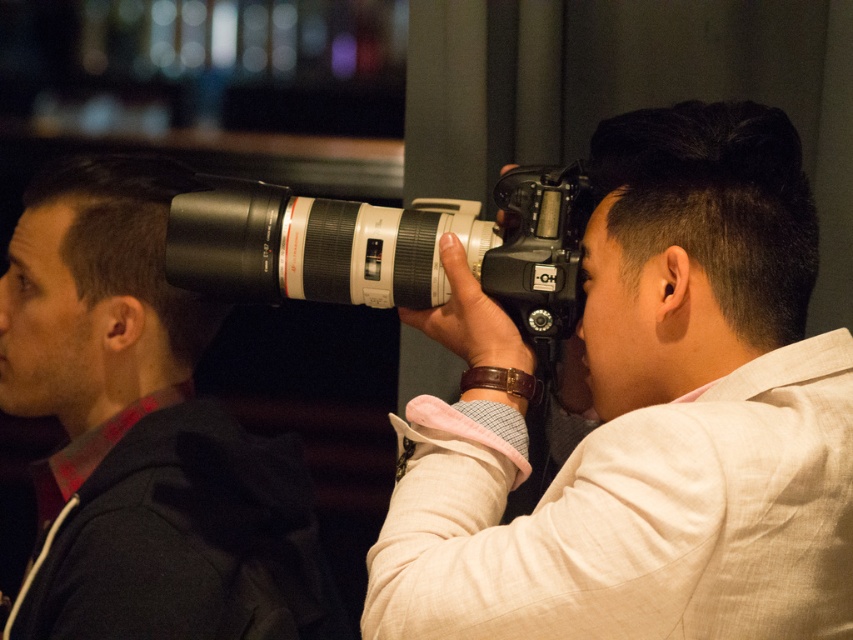
Can you confirm if matte black camera lens at upper left is thinner than black plastic camera at center?

Correct, matte black camera lens at upper left's width is less than black plastic camera at center's.

Can you confirm if matte black camera lens at upper left is smaller than black plastic camera at center?

Incorrect, matte black camera lens at upper left is not smaller in size than black plastic camera at center.

Who is more distant from viewer, (x=225, y=422) or (x=289, y=257)?

The point (x=225, y=422) is more distant.

I want to click on matte black camera lens at upper left, so click(x=142, y=433).

Can you confirm if matte black camera at center is positioned to the right of black plastic camera at center?

Indeed, matte black camera at center is positioned on the right side of black plastic camera at center.

Is point (735, 340) farther from camera compared to point (169, 221)?

No, (735, 340) is in front of (169, 221).

Does point (766, 461) lie in front of point (196, 253)?

Yes, it is.

This screenshot has height=640, width=853. Identify the location of matte black camera at center. (643, 417).

Does matte black camera at center have a greater height compared to matte black camera lens at upper left?

No, matte black camera at center is not taller than matte black camera lens at upper left.

In the scene shown: Does matte black camera at center come in front of matte black camera lens at upper left?

Yes, matte black camera at center is in front of matte black camera lens at upper left.

Who is more distant from viewer, (759, 557) or (259, 483)?

The point (259, 483) is behind.

Where is `matte black camera at center`? The width and height of the screenshot is (853, 640). matte black camera at center is located at coordinates (643, 417).